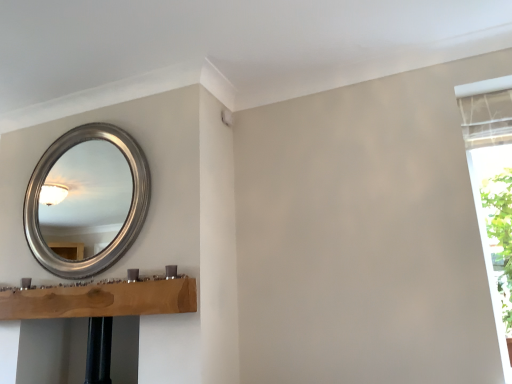
Locate an element on the screen. This screenshot has height=384, width=512. vacant space underneath silver metallic mirror at upper left (from a real-world perspective) is located at coordinates (88, 284).